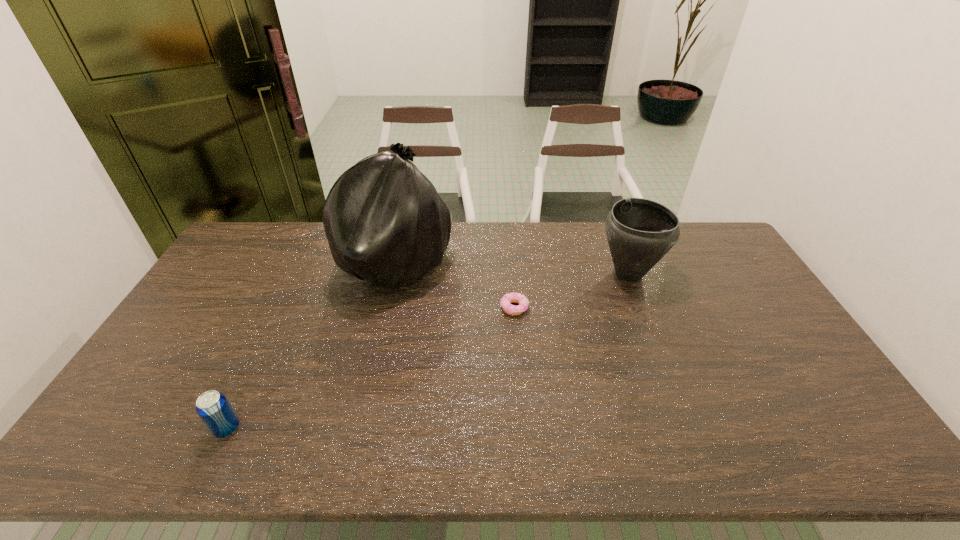
The height and width of the screenshot is (540, 960). Identify the location of plastic bag. (385, 223).

You are a GUI agent. You are given a task and a screenshot of the screen. Output one action in this format:
    pyautogui.click(x=<x>, y=<y>)
    Task: Click on the tallest object
    The width and height of the screenshot is (960, 540).
    Given the screenshot: What is the action you would take?
    (385, 223)

I want to click on the third shortest object, so click(640, 232).

This screenshot has height=540, width=960. I want to click on urn, so click(640, 232).

At what (x,y) coordinates should I click in order to perform the action: click on beer can. Please return your answer as a coordinate pair (x, y). The height and width of the screenshot is (540, 960). Looking at the image, I should click on (214, 409).

This screenshot has height=540, width=960. Find the location of `the second shortest object`. the second shortest object is located at coordinates (214, 409).

Locate an element on the screen. The width and height of the screenshot is (960, 540). the third object from left to right is located at coordinates (513, 297).

Image resolution: width=960 pixels, height=540 pixels. I want to click on doughnut, so click(513, 297).

You are a GUI agent. You are given a task and a screenshot of the screen. Output one action in this format:
    pyautogui.click(x=<x>, y=<y>)
    Task: Click on the vacant space located 0.170m on the front of the tallest object
    This screenshot has height=540, width=960.
    Given the screenshot: What is the action you would take?
    pyautogui.click(x=376, y=352)

The image size is (960, 540). Identify the location of vacant space situated on the left of the third shortest object. (567, 274).